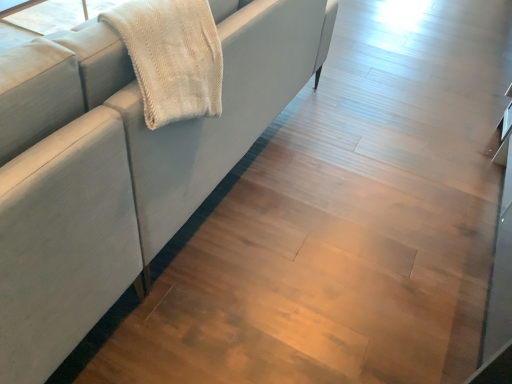
At what (x,y) coordinates should I click in order to perform the action: click on free space to the right of textured gray couch at center. Please return your answer as a coordinate pair (x, y). Image resolution: width=512 pixels, height=384 pixels. Looking at the image, I should click on (366, 216).